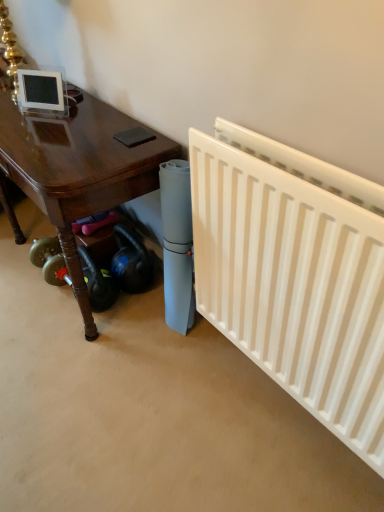
Where is `glossy wood table at lower left`? The image size is (384, 512). glossy wood table at lower left is located at coordinates (76, 170).

Image resolution: width=384 pixels, height=512 pixels. What do you see at coordinates (76, 170) in the screenshot?
I see `glossy wood table at lower left` at bounding box center [76, 170].

What do you see at coordinates (295, 274) in the screenshot? The height and width of the screenshot is (512, 384). I see `white matte radiator at right` at bounding box center [295, 274].

Identify the location of white matte radiator at right. (295, 274).

Locate an element on the screen. This screenshot has width=384, height=512. glossy wood table at lower left is located at coordinates (76, 170).

Which is more to the right, white matte radiator at right or glossy wood table at lower left?

Positioned to the right is white matte radiator at right.

Considering the positions of objects white matte radiator at right and glossy wood table at lower left in the image provided, who is in front, white matte radiator at right or glossy wood table at lower left?

white matte radiator at right.

Is point (363, 391) closer to camera compared to point (119, 115)?

Yes, it is.

Based on the photo, from the image's perspective, is white matte radiator at right located beneath glossy wood table at lower left?

Indeed, from the image's perspective, white matte radiator at right is shown beneath glossy wood table at lower left.

From a real-world perspective, who is located lower, white matte radiator at right or glossy wood table at lower left?

From a 3D spatial view, glossy wood table at lower left is below.

Which of these two, white matte radiator at right or glossy wood table at lower left, is thinner?

With smaller width is white matte radiator at right.

Is white matte radiator at right taller or shorter than glossy wood table at lower left?

In the image, white matte radiator at right appears to be taller than glossy wood table at lower left.

Does white matte radiator at right have a larger size compared to glossy wood table at lower left?

No.

Is glossy wood table at lower left a part of white matte radiator at right?

Definitely not — glossy wood table at lower left is not inside white matte radiator at right.

Is white matte radiator at right far away from glossy wood table at lower left?

No.

Is white matte radiator at right turned away from glossy wood table at lower left?

white matte radiator at right does not have its back to glossy wood table at lower left.

What's the angular difference between white matte radiator at right and glossy wood table at lower left's facing directions?

The angular difference between white matte radiator at right and glossy wood table at lower left is 0.34 degrees.

This screenshot has height=512, width=384. Identify the location of radiator in front of the glossy wood table at lower left. (295, 274).

Is glossy wood table at lower left to the right of white matte radiator at right from the viewer's perspective?

Incorrect, glossy wood table at lower left is not on the right side of white matte radiator at right.

Is glossy wood table at lower left in front of or behind white matte radiator at right in the image?

In the image, glossy wood table at lower left appears behind white matte radiator at right.

Considering the points (7, 209) and (372, 327), which point is in front, point (7, 209) or point (372, 327)?

Point (372, 327)

Consider the image. From the image's perspective, between glossy wood table at lower left and white matte radiator at right, which one is located above?

From the image's view, glossy wood table at lower left is above.

From a real-world perspective, which object stands above the other?

From a 3D spatial view, white matte radiator at right is above.

Considering the sizes of glossy wood table at lower left and white matte radiator at right in the image, is glossy wood table at lower left wider or thinner than white matte radiator at right?

Clearly, glossy wood table at lower left has more width compared to white matte radiator at right.

Is glossy wood table at lower left taller or shorter than white matte radiator at right?

Clearly, glossy wood table at lower left is shorter compared to white matte radiator at right.

Who is bigger, glossy wood table at lower left or white matte radiator at right?

Bigger between the two is glossy wood table at lower left.

Is glossy wood table at lower left surrounding white matte radiator at right?

No, white matte radiator at right is located outside of glossy wood table at lower left.

Would you say glossy wood table at lower left is a long distance from white matte radiator at right?

Actually, glossy wood table at lower left and white matte radiator at right are a little close together.

Could you tell me if glossy wood table at lower left is turned towards white matte radiator at right?

No, glossy wood table at lower left does not turn towards white matte radiator at right.

This screenshot has height=512, width=384. I want to click on table behind the white matte radiator at right, so click(76, 170).

You are a GUI agent. You are given a task and a screenshot of the screen. Output one action in this format:
    pyautogui.click(x=<x>, y=<y>)
    Task: Click on the radiator above the glossy wood table at lower left (from a real-world perspective)
    The height and width of the screenshot is (512, 384).
    Given the screenshot: What is the action you would take?
    pyautogui.click(x=295, y=274)

Identify the location of table below the white matte radiator at right (from a real-world perspective). This screenshot has width=384, height=512. (76, 170).